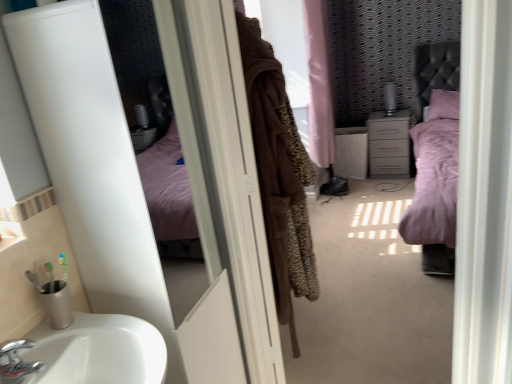
The image size is (512, 384). What do you see at coordinates (140, 182) in the screenshot?
I see `white glossy screen door at upper left, which is the 1th screen door in left-to-right order` at bounding box center [140, 182].

Locate an element on the screen. The width and height of the screenshot is (512, 384). brown fuzzy towel at center, placed as the 2th screen door when sorted from left to right is located at coordinates (229, 178).

The image size is (512, 384). What are the coordinates of `white glossy screen door at upper left, which is the 1th screen door in left-to-right order` in the screenshot? It's located at (140, 182).

In the image, is brown fuzzy coat at center positioned in front of or behind brown fuzzy towel at center, placed as the 2th screen door when sorted from left to right?

In the image, brown fuzzy coat at center appears behind brown fuzzy towel at center, placed as the 2th screen door when sorted from left to right.

How many degrees apart are the facing directions of brown fuzzy coat at center and brown fuzzy towel at center, acting as the first screen door starting from the right?

There is a 99.9-degree angle between the facing directions of brown fuzzy coat at center and brown fuzzy towel at center, acting as the first screen door starting from the right.

Considering the points (291, 123) and (259, 371), which point is in front, point (291, 123) or point (259, 371)?

Positioned in front is point (259, 371).

Based on their positions, is brown fuzzy coat at center located to the left or right of brown fuzzy towel at center, acting as the first screen door starting from the right?

Clearly, brown fuzzy coat at center is on the right of brown fuzzy towel at center, acting as the first screen door starting from the right, in the image.

How different are the orientations of pink plush bed at center and white glossy screen door at upper left, which is counted as the second screen door, starting from the right, in degrees?

They differ by 91.2 degrees in their facing directions.

Would you say pink plush bed at center is inside or outside white glossy screen door at upper left, which is counted as the second screen door, starting from the right?

pink plush bed at center is not inside white glossy screen door at upper left, which is counted as the second screen door, starting from the right, it's outside.

From a real-world perspective, is pink plush bed at center physically located above or below white glossy screen door at upper left, which is the 1th screen door in left-to-right order?

pink plush bed at center is below white glossy screen door at upper left, which is the 1th screen door in left-to-right order.

Is pink plush bed at center to the right of white glossy screen door at upper left, which is the 1th screen door in left-to-right order, from the viewer's perspective?

Yes.

Which is closer, (273, 218) or (442, 66)?

The point (273, 218) is more forward.

Is brown fuzzy coat at center outside of pink plush bed at center?

Indeed, brown fuzzy coat at center is completely outside pink plush bed at center.

Considering the positions of objects brown fuzzy coat at center and pink plush bed at center in the image provided, who is in front, brown fuzzy coat at center or pink plush bed at center?

Positioned in front is brown fuzzy coat at center.

Is brown fuzzy coat at center looking in the opposite direction of pink plush bed at center?

No, brown fuzzy coat at center is not facing the opposite direction of pink plush bed at center.

Is pink plush bed at center thinner than matte gray chest of drawers at center?

In fact, pink plush bed at center might be wider than matte gray chest of drawers at center.

Is the position of pink plush bed at center less distant than that of matte gray chest of drawers at center?

Yes, the depth of pink plush bed at center is less than that of matte gray chest of drawers at center.

Does pink plush bed at center have a larger size compared to matte gray chest of drawers at center?

Indeed, pink plush bed at center has a larger size compared to matte gray chest of drawers at center.

From their relative heights in the image, would you say pink plush bed at center is taller or shorter than matte gray chest of drawers at center?

Clearly, pink plush bed at center is taller compared to matte gray chest of drawers at center.

Consider the image. Which of these two, pink plush bed at center or chrome metallic faucet at lower left, is wider?

pink plush bed at center is wider.

Based on the photo, from the image's perspective, who appears lower, pink plush bed at center or chrome metallic faucet at lower left?

From the image's view, chrome metallic faucet at lower left is below.

Is pink plush bed at center looking in the opposite direction of chrome metallic faucet at lower left?

pink plush bed at center is not turned away from chrome metallic faucet at lower left.

Is chrome metallic faucet at lower left oriented away from matte gray chest of drawers at center?

chrome metallic faucet at lower left is not turned away from matte gray chest of drawers at center.

Which is more to the right, chrome metallic faucet at lower left or matte gray chest of drawers at center?

Positioned to the right is matte gray chest of drawers at center.

Which is in front, point (17, 370) or point (388, 162)?

The point (17, 370) is closer to the camera.

Which is nearer, (402,127) or (226,46)?

The point (226,46) is closer to the camera.

In the scene shown: From a real-world perspective, is matte gray chest of drawers at center on white glossy screen door at upper left, which is counted as the second screen door, starting from the right?

No, from a real-world perspective, matte gray chest of drawers at center is not on top of white glossy screen door at upper left, which is counted as the second screen door, starting from the right.

Does matte gray chest of drawers at center have a greater height compared to white glossy screen door at upper left, which is counted as the second screen door, starting from the right?

Incorrect, the height of matte gray chest of drawers at center is not larger of that of white glossy screen door at upper left, which is counted as the second screen door, starting from the right.

The image size is (512, 384). Find the location of `clothing behind the brown fuzzy towel at center, acting as the first screen door starting from the right`. clothing behind the brown fuzzy towel at center, acting as the first screen door starting from the right is located at coordinates (279, 174).

This screenshot has height=384, width=512. In the image, there is a white glossy screen door at upper left, which is the 1th screen door in left-to-right order. Identify the location of bed above it (from the image's perspective). (435, 157).

When comparing their distances from brown fuzzy coat at center, does pink plush bed at center or matte gray chest of drawers at center seem closer?

pink plush bed at center is closer to brown fuzzy coat at center.

Considering their positions, is pink plush bed at center positioned closer to brown fuzzy coat at center than brown fuzzy towel at center, acting as the first screen door starting from the right?

Among the two, brown fuzzy towel at center, acting as the first screen door starting from the right, is located nearer to brown fuzzy coat at center.

Looking at this image, based on their spatial positions, is brown fuzzy towel at center, placed as the 2th screen door when sorted from left to right, or matte gray chest of drawers at center further from chrome metallic faucet at lower left?

matte gray chest of drawers at center lies further to chrome metallic faucet at lower left than the other object.

Estimate the real-world distances between objects in this image. Which object is further from brown fuzzy towel at center, placed as the 2th screen door when sorted from left to right, white glossy screen door at upper left, which is the 1th screen door in left-to-right order, or matte gray chest of drawers at center?

Among the two, matte gray chest of drawers at center is located further to brown fuzzy towel at center, placed as the 2th screen door when sorted from left to right.

Which object lies further to the anchor point white glossy screen door at upper left, which is the 1th screen door in left-to-right order, brown fuzzy towel at center, placed as the 2th screen door when sorted from left to right, or matte gray chest of drawers at center?

Among the two, matte gray chest of drawers at center is located further to white glossy screen door at upper left, which is the 1th screen door in left-to-right order.

When comparing their distances from pink plush bed at center, does brown fuzzy coat at center or chrome metallic faucet at lower left seem further?

Based on the image, chrome metallic faucet at lower left appears to be further to pink plush bed at center.

When comparing their distances from pink plush bed at center, does matte gray chest of drawers at center or chrome metallic faucet at lower left seem further?

chrome metallic faucet at lower left is further to pink plush bed at center.

Looking at the image, which one is located further to chrome metallic faucet at lower left, brown fuzzy towel at center, placed as the 2th screen door when sorted from left to right, or white glossy screen door at upper left, which is the 1th screen door in left-to-right order?

Among the two, brown fuzzy towel at center, placed as the 2th screen door when sorted from left to right, is located further to chrome metallic faucet at lower left.

The height and width of the screenshot is (384, 512). I want to click on clothing between white glossy screen door at upper left, which is the 1th screen door in left-to-right order, and pink plush bed at center from left to right, so click(x=279, y=174).

The image size is (512, 384). In order to click on tap between white glossy screen door at upper left, which is the 1th screen door in left-to-right order, and matte gray chest of drawers at center from front to back in this screenshot , I will do tap(16, 362).

Locate an element on the screen. Image resolution: width=512 pixels, height=384 pixels. clothing situated between brown fuzzy towel at center, acting as the first screen door starting from the right, and pink plush bed at center from left to right is located at coordinates (279, 174).

This screenshot has width=512, height=384. I want to click on bed between white glossy screen door at upper left, which is the 1th screen door in left-to-right order, and matte gray chest of drawers at center from front to back, so click(x=435, y=157).